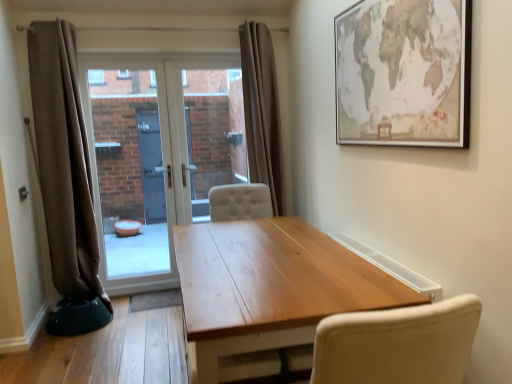
Question: Considering the positions of brown fabric curtain at left, which is the 2th curtain from right to left, and wooden table at center in the image, is brown fabric curtain at left, which is the 2th curtain from right to left, bigger or smaller than wooden table at center?

Choices:
 (A) small
 (B) big

Answer: (A)

Question: Considering the positions of brown fabric curtain at left, the 1th curtain from the left, and wooden table at center in the image, is brown fabric curtain at left, the 1th curtain from the left, taller or shorter than wooden table at center?

Choices:
 (A) tall
 (B) short

Answer: (A)

Question: Which of these objects is positioned closest to the matte paper map at upper right?

Choices:
 (A) white glossy door at center
 (B) transparent glass door at center, acting as the 1th window screen starting from the right
 (C) transparent glass door at center, which is the 2th window screen from right to left
 (D) wooden table at center
 (E) brown fabric curtain at left, the 1th curtain from the left

Answer: (D)

Question: Estimate the real-world distances between objects in this image. Which object is closer to the matte paper map at upper right?

Choices:
 (A) transparent glass door at center, acting as the 1th window screen starting from the right
 (B) white glossy door at center
 (C) transparent glass door at center, which is counted as the 1th window screen, starting from the left
 (D) brown fabric curtain at left, which is the 2th curtain from right to left
 (E) brown fabric curtain at center, the 1th curtain from the right

Answer: (E)